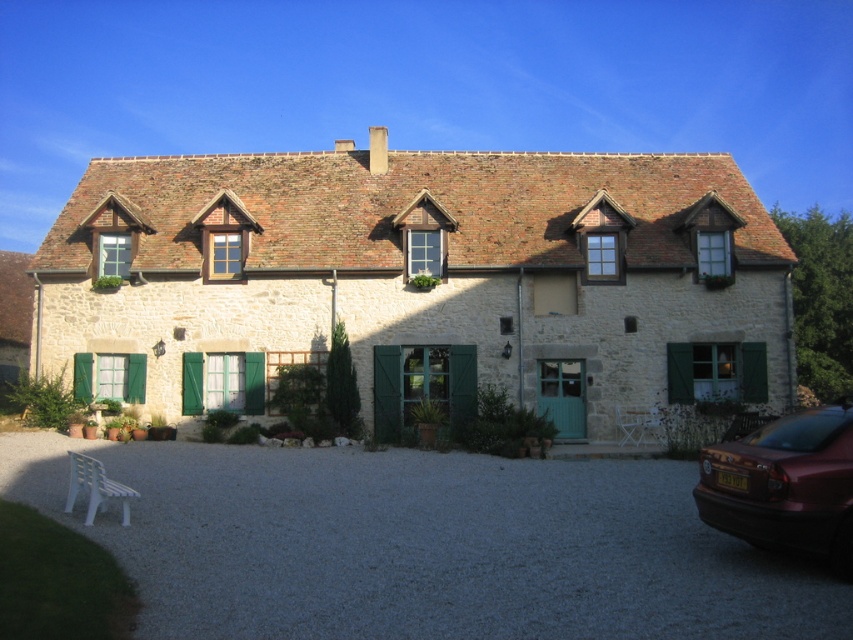
Question: Can you confirm if shiny maroon sedan at lower right is thinner than green matte shutter at lower left?

Choices:
 (A) no
 (B) yes

Answer: (B)

Question: Which point is farther to the camera?

Choices:
 (A) (722, 256)
 (B) (427, 234)

Answer: (B)

Question: Is green wooden shutter at upper right below green wooden shutter at upper center?

Choices:
 (A) no
 (B) yes

Answer: (A)

Question: Which of these objects is positioned farthest from the stone cottage at center?

Choices:
 (A) green wooden shutter at upper center
 (B) green wooden shutter at upper right
 (C) green matte shutter at lower left

Answer: (B)

Question: Which object appears farthest from the camera in this image?

Choices:
 (A) green matte shutter at center
 (B) shiny maroon sedan at lower right
 (C) gray gravel driveway at center

Answer: (A)

Question: Does gray gravel driveway at center have a larger size compared to green wooden shutter at upper right?

Choices:
 (A) no
 (B) yes

Answer: (B)